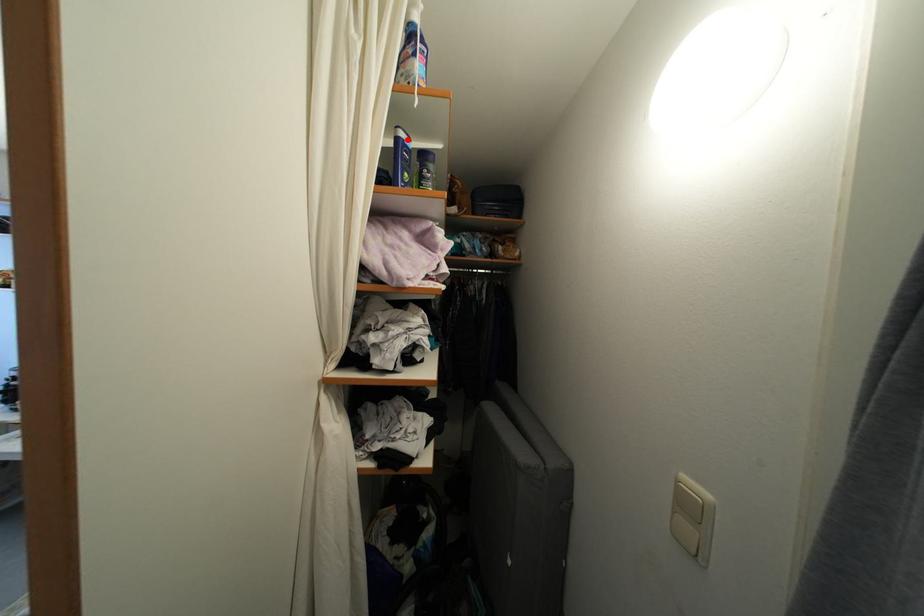
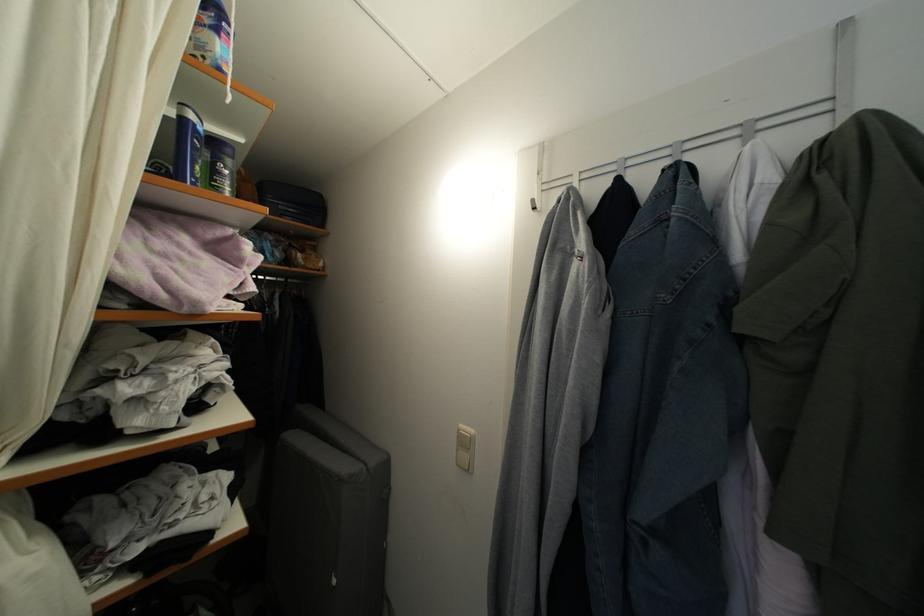
In the second image, find the point that corresponds to the highlighted location in the first image.

(198, 122)